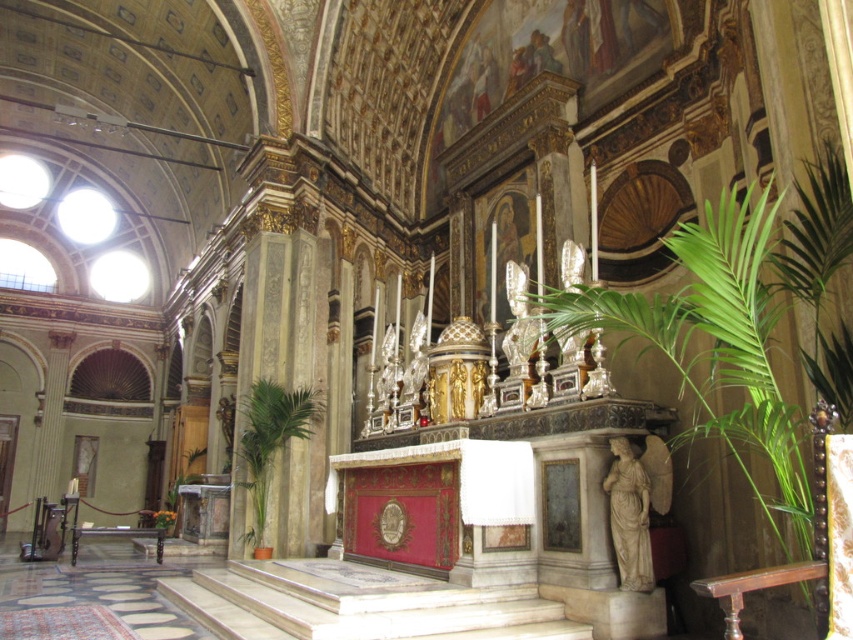
You are a GUI agent. You are given a task and a screenshot of the screen. Output one action in this format:
    pyautogui.click(x=<x>, y=<y>)
    Task: Click on the green leafy plant at right
    
    Given the screenshot: What is the action you would take?
    pyautogui.click(x=735, y=330)

Based on the photo, which is more to the right, green leafy plant at right or green leafy plant at lower left?

green leafy plant at right is more to the right.

Who is more forward, (x=792, y=257) or (x=260, y=525)?

Positioned in front is point (x=792, y=257).

Image resolution: width=853 pixels, height=640 pixels. In order to click on green leafy plant at right in this screenshot , I will do pyautogui.click(x=735, y=330).